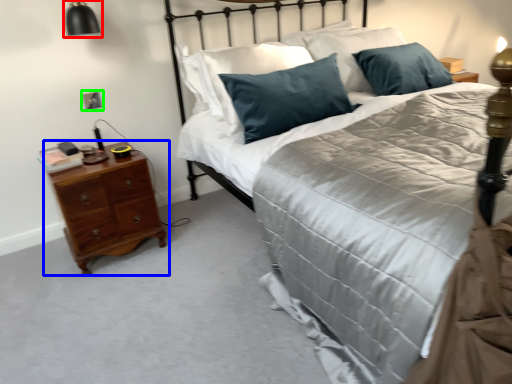
Question: Considering the real-world distances, which object is closest to bedside lamp (highlighted by a red box)? nightstand (highlighted by a blue box) or electric outlet (highlighted by a green box).

Choices:
 (A) nightstand
 (B) electric outlet

Answer: (B)